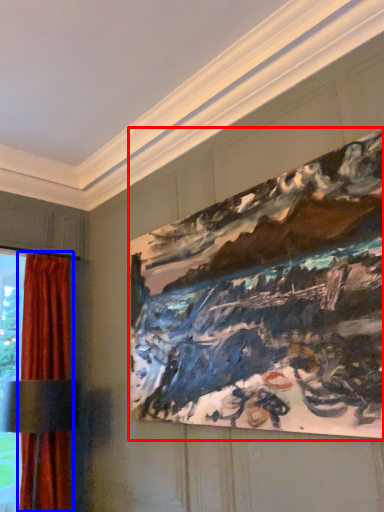
Question: Which of the following is the farthest to the observer, picture frame (highlighted by a red box) or curtain (highlighted by a blue box)?

Choices:
 (A) picture frame
 (B) curtain

Answer: (B)